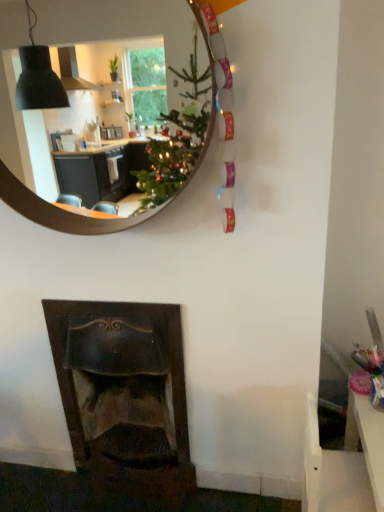
Question: Considering the positions of wooden mirror at upper center and white plastic table at lower right in the image, is wooden mirror at upper center wider or thinner than white plastic table at lower right?

Choices:
 (A) wide
 (B) thin

Answer: (B)

Question: From a real-world perspective, is wooden mirror at upper center above or below white plastic table at lower right?

Choices:
 (A) above
 (B) below

Answer: (A)

Question: Which object is the farthest from the dark wood fireplace at lower left?

Choices:
 (A) white plastic table at lower right
 (B) wooden mirror at upper center

Answer: (B)

Question: Which of these objects is positioned closest to the dark wood fireplace at lower left?

Choices:
 (A) white plastic table at lower right
 (B) wooden mirror at upper center

Answer: (A)